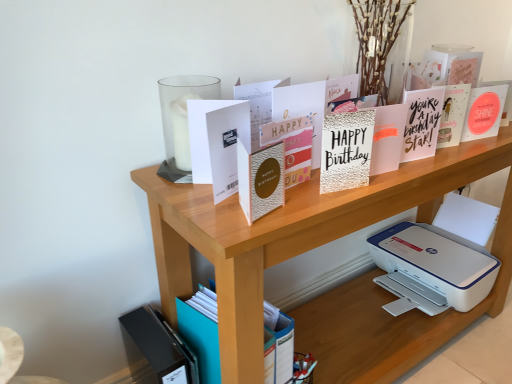
Question: Is white matte card at upper center, which is counted as the 1th paperback book, starting from the left, located outside metallic gold card at upper center?

Choices:
 (A) no
 (B) yes

Answer: (B)

Question: Does white matte card at upper center, acting as the 8th paperback book starting from the right, have a lesser height compared to metallic gold card at upper center?

Choices:
 (A) yes
 (B) no

Answer: (A)

Question: Considering the relative sizes of white matte card at upper center, acting as the 8th paperback book starting from the right, and metallic gold card at upper center in the image provided, is white matte card at upper center, acting as the 8th paperback book starting from the right, wider than metallic gold card at upper center?

Choices:
 (A) yes
 (B) no

Answer: (B)

Question: Is white matte card at upper center, which is counted as the 1th paperback book, starting from the left, with metallic gold card at upper center?

Choices:
 (A) no
 (B) yes

Answer: (A)

Question: Would you consider white matte card at upper center, acting as the 8th paperback book starting from the right, to be distant from metallic gold card at upper center?

Choices:
 (A) no
 (B) yes

Answer: (A)

Question: From the image's perspective, is white matte card at upper center, acting as the 8th paperback book starting from the right, under metallic gold card at upper center?

Choices:
 (A) no
 (B) yes

Answer: (B)

Question: Can you confirm if white matte card at upper center, which is counted as the 1th paperback book, starting from the left, is taller than silver glitter card at center, the 3th paperback book viewed from the right?

Choices:
 (A) yes
 (B) no

Answer: (A)

Question: Does white matte card at upper center, acting as the 8th paperback book starting from the right, have a smaller size compared to silver glitter card at center, the 6th paperback book when ordered from left to right?

Choices:
 (A) yes
 (B) no

Answer: (B)

Question: Considering the relative sizes of white matte card at upper center, which is counted as the 1th paperback book, starting from the left, and silver glitter card at center, the 3th paperback book viewed from the right, in the image provided, is white matte card at upper center, which is counted as the 1th paperback book, starting from the left, wider than silver glitter card at center, the 3th paperback book viewed from the right,?

Choices:
 (A) no
 (B) yes

Answer: (A)

Question: From a real-world perspective, is white matte card at upper center, acting as the 8th paperback book starting from the right, physically above silver glitter card at center, the 6th paperback book when ordered from left to right?

Choices:
 (A) no
 (B) yes

Answer: (B)

Question: Does white matte card at upper center, acting as the 8th paperback book starting from the right, have a lesser width compared to silver glitter card at center, the 6th paperback book when ordered from left to right?

Choices:
 (A) no
 (B) yes

Answer: (B)

Question: Is silver glitter card at center, the 6th paperback book when ordered from left to right, surrounded by white matte card at upper center, which is counted as the 1th paperback book, starting from the left?

Choices:
 (A) yes
 (B) no

Answer: (B)

Question: Considering the relative sizes of wooden shelf at upper center and matte white card at upper right, the first paperback book when ordered from right to left, in the image provided, is wooden shelf at upper center bigger than matte white card at upper right, the first paperback book when ordered from right to left,?

Choices:
 (A) no
 (B) yes

Answer: (B)